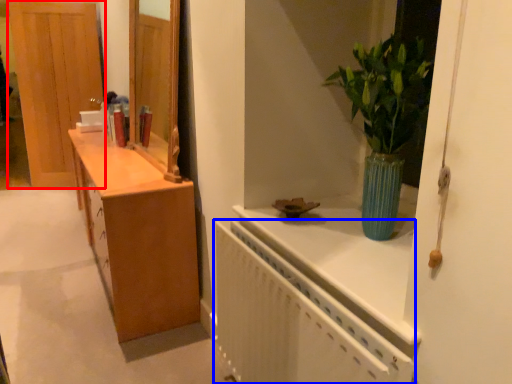
Question: Which object is further to the camera taking this photo, door (highlighted by a red box) or radiator (highlighted by a blue box)?

Choices:
 (A) door
 (B) radiator

Answer: (A)